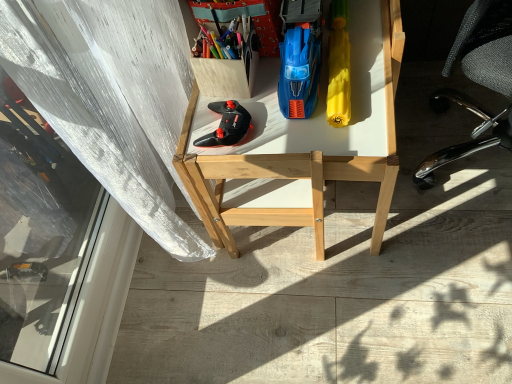
Question: Is point (202, 33) closer or farther from the camera than point (287, 112)?

Choices:
 (A) closer
 (B) farther

Answer: (A)

Question: Based on their sizes in the image, would you say matte plastic container at upper center, marked as the fourth stationery in a right-to-left arrangement, is bigger or smaller than blue plastic toy car at center, the third stationery when ordered from left to right?

Choices:
 (A) big
 (B) small

Answer: (B)

Question: Considering the real-world distances, which object is farthest from the yellow matte umbrella at right, the fourth stationery from the left?

Choices:
 (A) black mesh office chair at right
 (B) blue plastic toy car at center, the third stationery when ordered from left to right
 (C) black matte controller at center
 (D) matte plastic container at upper center, marked as the fourth stationery in a right-to-left arrangement
 (E) wooden box at upper left, which appears as the third stationery when viewed from the right

Answer: (A)

Question: Which is nearer to the wooden desk at center?

Choices:
 (A) wooden box at upper left, which appears as the third stationery when viewed from the right
 (B) black matte controller at center
 (C) yellow matte umbrella at right, the fourth stationery from the left
 (D) black mesh office chair at right
 (E) matte plastic container at upper center, positioned as the first stationery in left-to-right order

Answer: (C)